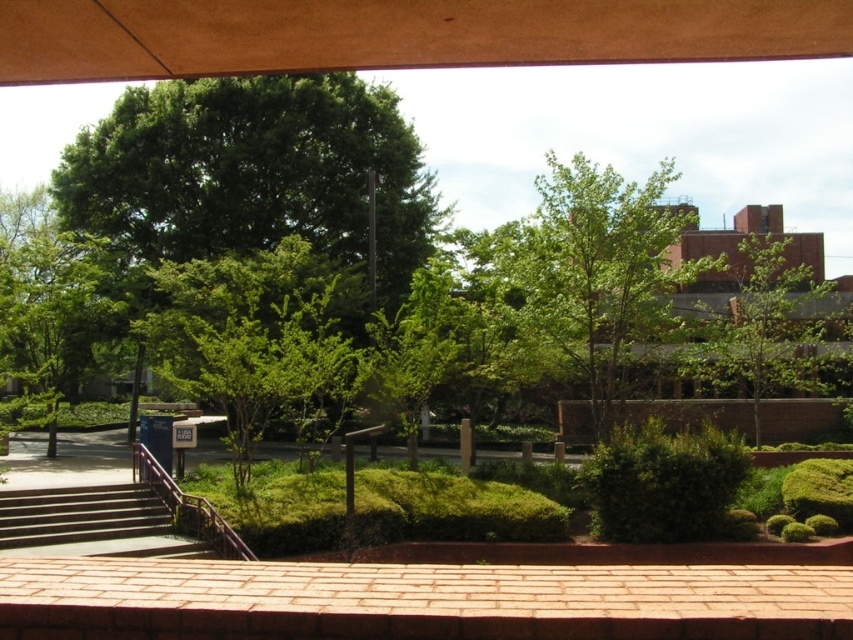
Question: Is green leafy tree at center further to camera compared to purple metallic rail at lower left?

Choices:
 (A) no
 (B) yes

Answer: (B)

Question: Which of these objects is positioned closest to the concrete stairs at lower left?

Choices:
 (A) purple metallic rail at lower left
 (B) green leafy bush at center
 (C) green leafy tree at center
 (D) green leafy tree at upper center

Answer: (A)

Question: Which point is closer to the camera taking this photo?

Choices:
 (A) (590, 499)
 (B) (767, 316)

Answer: (A)

Question: Does green leafy tree at center appear on the right side of purple metallic rail at lower left?

Choices:
 (A) no
 (B) yes

Answer: (B)

Question: Does green leafy tree at upper center have a lesser width compared to green leafy bush at center?

Choices:
 (A) yes
 (B) no

Answer: (B)

Question: Which of these objects is positioned closest to the green leafy tree at center?

Choices:
 (A) purple metallic rail at lower left
 (B) concrete stairs at lower left
 (C) green leafy bush at center

Answer: (C)